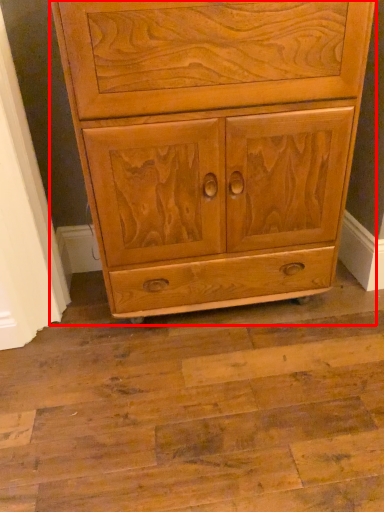
Question: From the image's perspective, what is the correct spatial relationship of chest of drawers (annotated by the red box) in relation to screen door?

Choices:
 (A) below
 (B) above

Answer: (B)